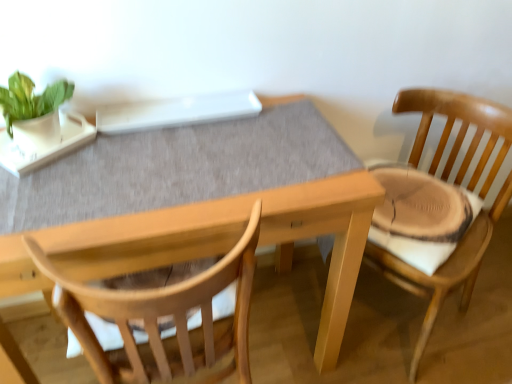
Image resolution: width=512 pixels, height=384 pixels. I want to click on vacant point above wooden table at center (from a real-world perspective), so click(x=160, y=159).